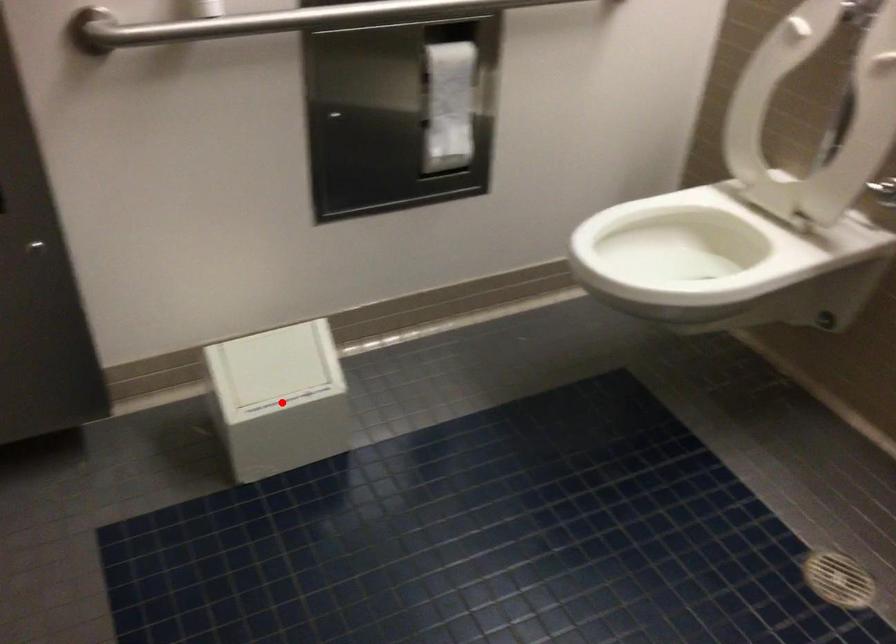
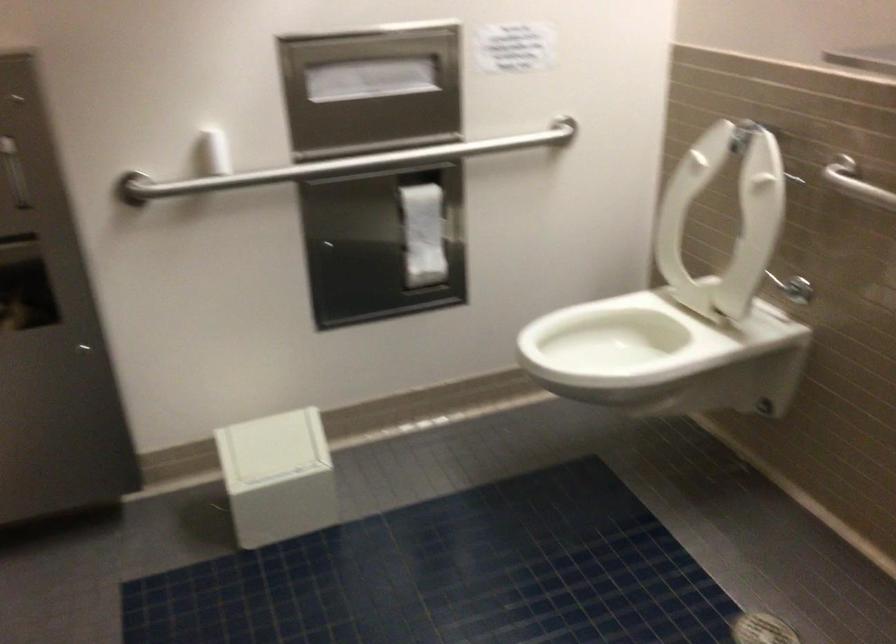
Find the pixel in the second image that matches the highlighted location in the first image.

(278, 477)